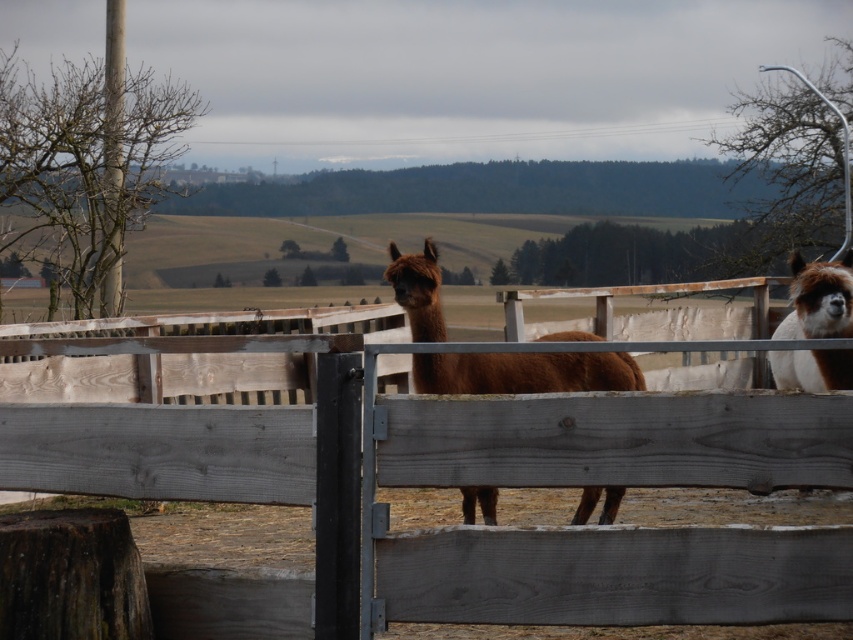
Which of these two, brown woolly alpaca at center or brown woolly alpaca at right, stands taller?

Standing taller between the two is brown woolly alpaca at center.

Between point (602, 513) and point (808, 288), which one is positioned behind?

The point (602, 513) is more distant.

Is point (444, 333) behind point (804, 294)?

Yes, it is behind point (804, 294).

You are a GUI agent. You are given a task and a screenshot of the screen. Output one action in this format:
    pyautogui.click(x=<x>, y=<y>)
    Task: Click on the brown woolly alpaca at center
    The image size is (853, 640).
    Given the screenshot: What is the action you would take?
    pyautogui.click(x=524, y=372)

Between brown wooden fence at center and brown woolly alpaca at right, which one is positioned higher?

brown woolly alpaca at right

Does brown wooden fence at center appear under brown woolly alpaca at right?

Indeed, brown wooden fence at center is positioned under brown woolly alpaca at right.

Find the location of a particular element. brown wooden fence at center is located at coordinates (428, 467).

Is brown wooden fence at center behind brown woolly alpaca at center?

No, it is in front of brown woolly alpaca at center.

Is brown wooden fence at center above brown woolly alpaca at center?

No, brown wooden fence at center is not above brown woolly alpaca at center.

Identify the location of brown wooden fence at center. (428, 467).